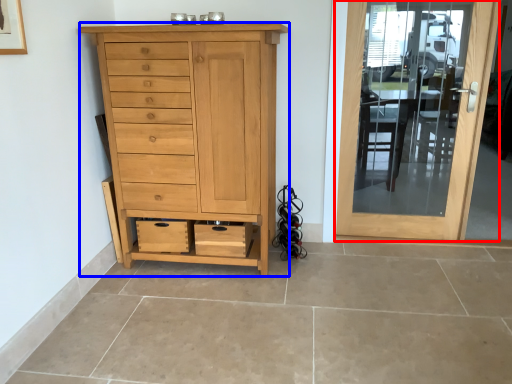
Question: Which point is further to the camera, door (highlighted by a red box) or chest of drawers (highlighted by a blue box)?

Choices:
 (A) door
 (B) chest of drawers

Answer: (A)